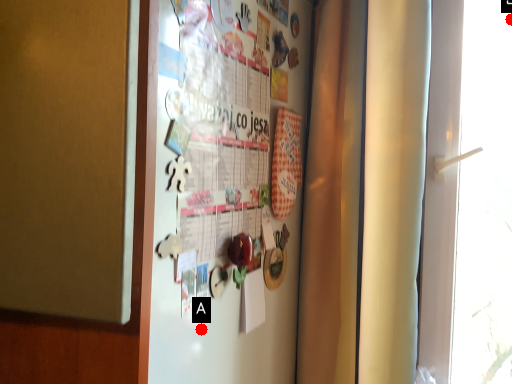
Question: Two points are circled on the image, labeled by A and B beside each circle. Which of the following is the farthest from the observer?

Choices:
 (A) A is further
 (B) B is further

Answer: (B)